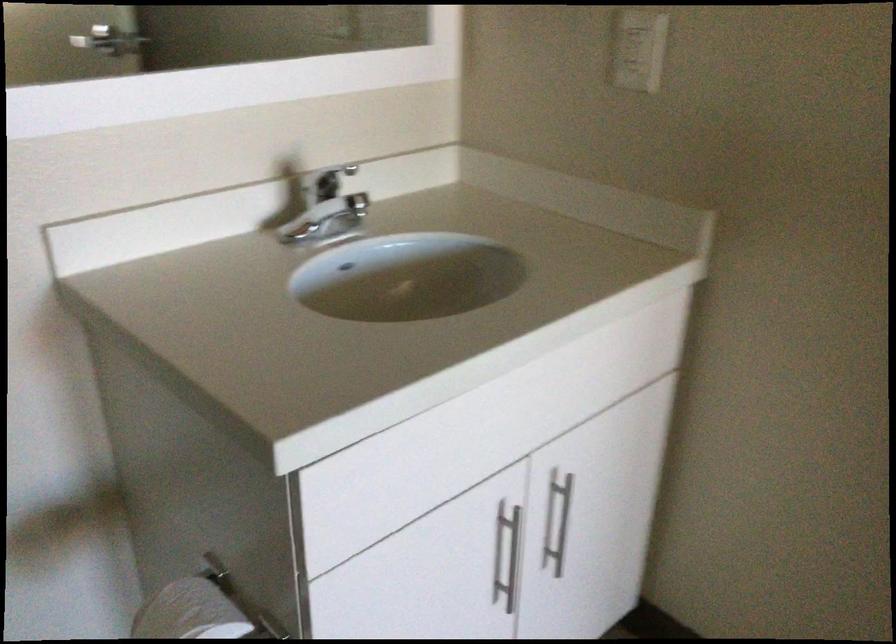
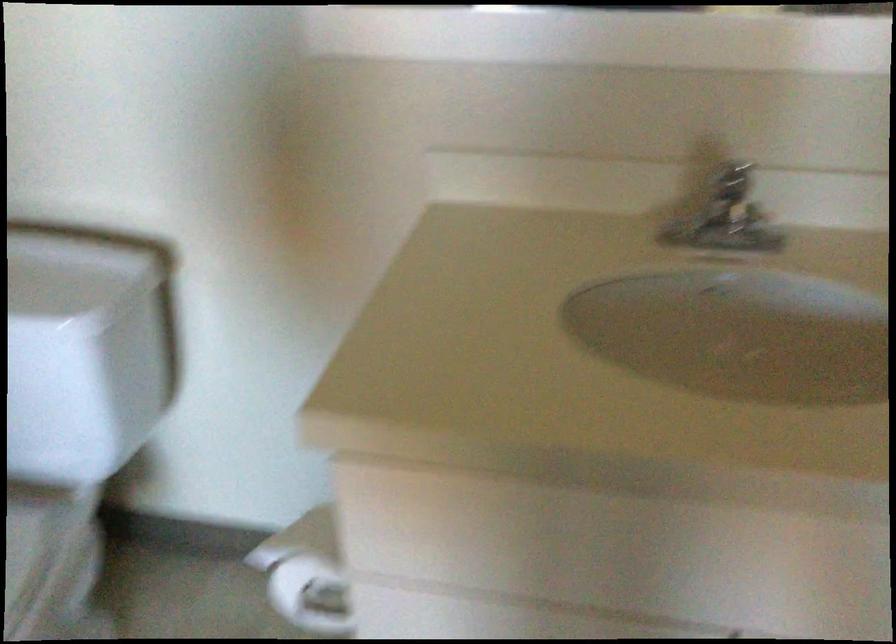
Question: Based on the continuous images, in which direction is the camera rotating? Reply with the corresponding letter.

Choices:
 (A) Left
 (B) Right
 (C) Up
 (D) Down

Answer: (A)